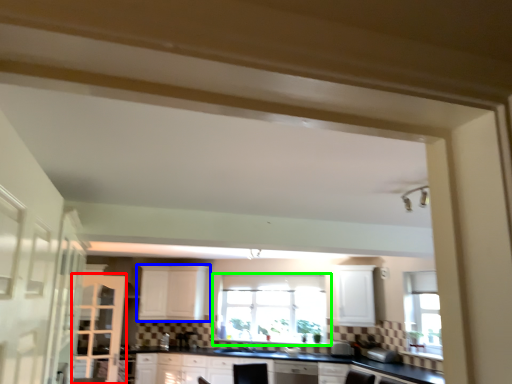
Question: Estimate the real-world distances between objects in this image. Which object is closer to screen door (highlighted by a red box), cabinetry (highlighted by a blue box) or window (highlighted by a green box)?

Choices:
 (A) cabinetry
 (B) window

Answer: (A)